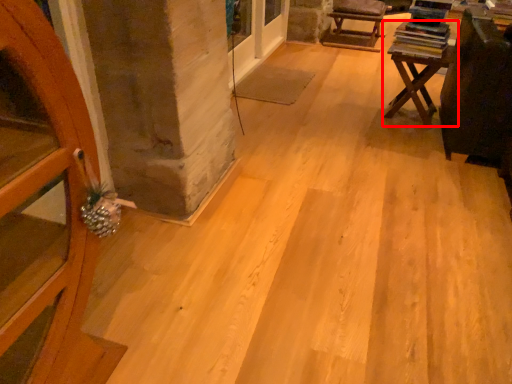
Question: In this image, where is table (annotated by the red box) located relative to armchair?

Choices:
 (A) left
 (B) right

Answer: (B)